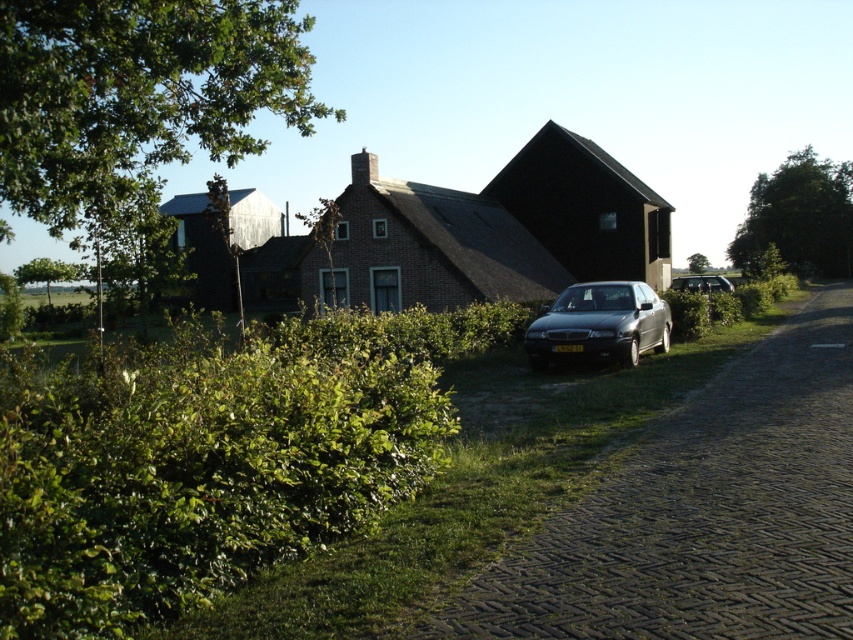
Question: Is dark gray cobblestone driveway at lower right to the left of satin black sedan at center-right from the viewer's perspective?

Choices:
 (A) yes
 (B) no

Answer: (A)

Question: Which object is positioned closest to the satin black sedan at center-right?

Choices:
 (A) green leafy hedge at lower left
 (B) dark gray cobblestone driveway at lower right

Answer: (B)

Question: Which object is positioned closest to the green leafy hedge at lower left?

Choices:
 (A) dark gray cobblestone driveway at lower right
 (B) satin black sedan at center-right

Answer: (A)

Question: Considering the real-world distances, which object is farthest from the satin black sedan at center-right?

Choices:
 (A) dark gray cobblestone driveway at lower right
 (B) satin black sedan at center
 (C) green leafy hedge at lower left

Answer: (C)

Question: Can you confirm if satin black sedan at center is positioned to the right of satin black sedan at center-right?

Choices:
 (A) yes
 (B) no

Answer: (B)

Question: Considering the relative positions of satin black sedan at center and satin black sedan at center-right in the image provided, where is satin black sedan at center located with respect to satin black sedan at center-right?

Choices:
 (A) left
 (B) right

Answer: (A)